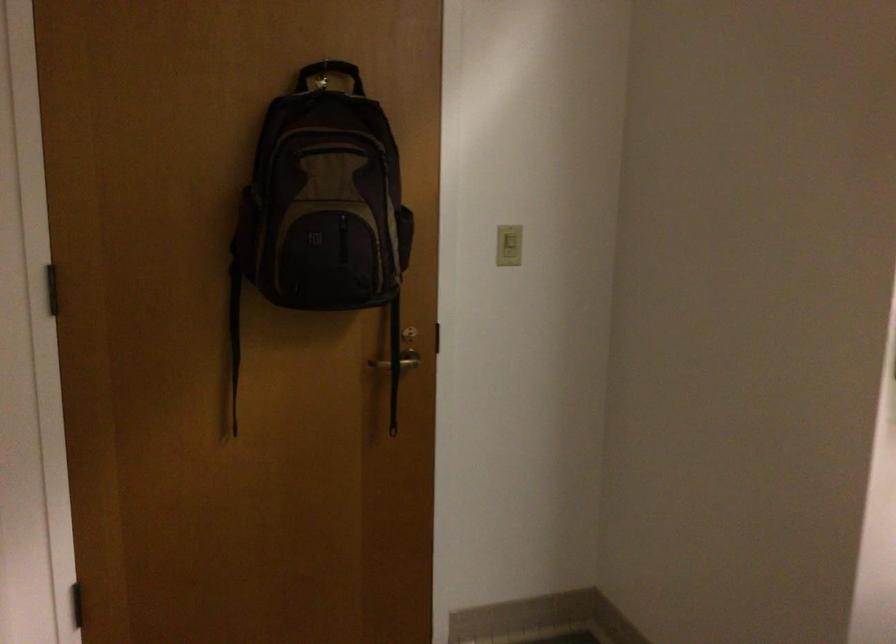
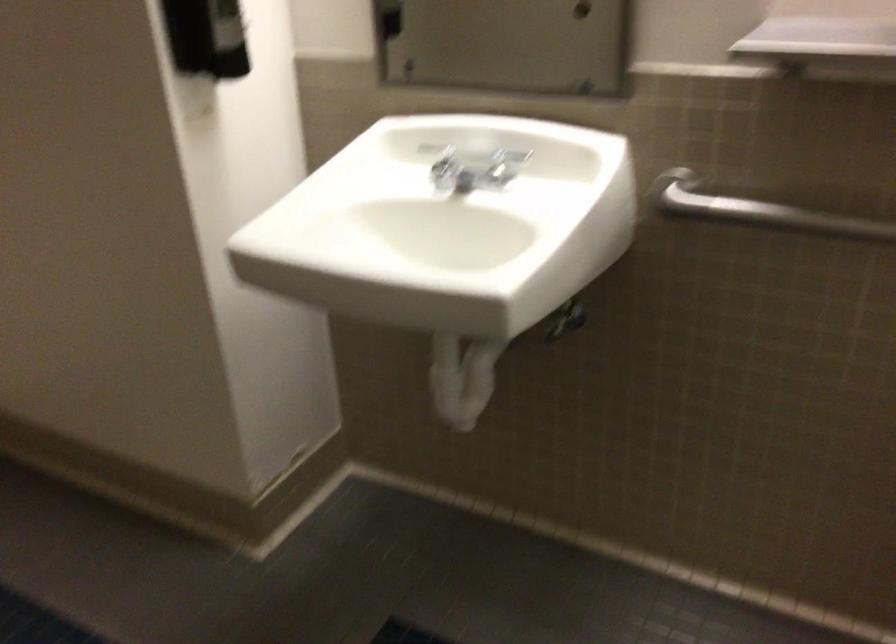
Looking at this image, the images are taken continuously from a first-person perspective. In which direction is your viewpoint rotating?

The rotation direction of the camera is right-down.